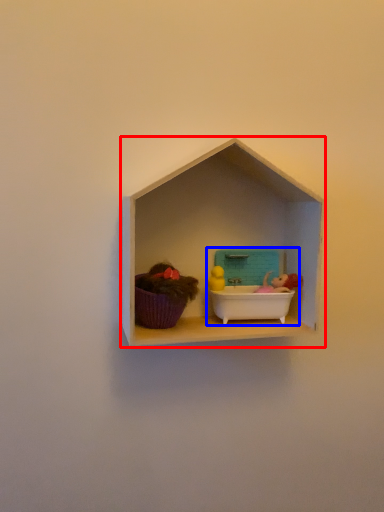
Question: Which object is further to the camera taking this photo, shelf (highlighted by a red box) or lunch box (highlighted by a blue box)?

Choices:
 (A) shelf
 (B) lunch box

Answer: (B)